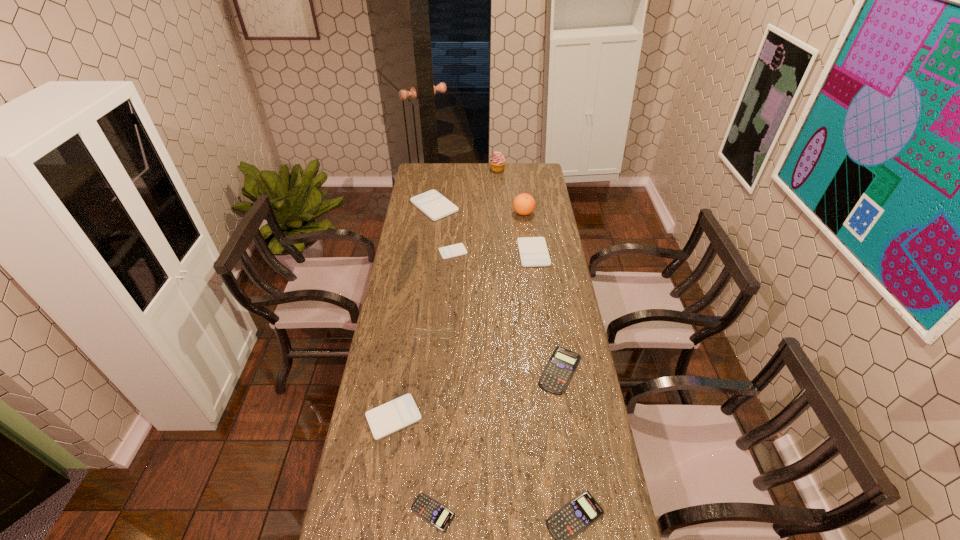
The height and width of the screenshot is (540, 960). Find the location of `vacant space at the far left corner of the desktop`. vacant space at the far left corner of the desktop is located at coordinates (432, 166).

This screenshot has height=540, width=960. Find the location of `unoccupied position between the orange and the leftmost blue calculator`. unoccupied position between the orange and the leftmost blue calculator is located at coordinates tap(478, 363).

At what (x,y) coordinates should I click in order to perform the action: click on free point between the orange and the biggest blue calculator. Please return your answer as a coordinate pair (x, y). Image resolution: width=960 pixels, height=540 pixels. Looking at the image, I should click on (541, 292).

The width and height of the screenshot is (960, 540). In order to click on vacant space in between the smallest white calculator and the fourth tallest object in this screenshot , I will do `click(444, 229)`.

Find the location of a particular element. This screenshot has width=960, height=540. free space between the sixth object from left to right and the farthest blue calculator is located at coordinates (529, 270).

Image resolution: width=960 pixels, height=540 pixels. Find the location of `free point between the farthest blue calculator and the fifth tallest object`. free point between the farthest blue calculator and the fifth tallest object is located at coordinates (547, 312).

This screenshot has width=960, height=540. In order to click on empty space between the orange orange and the smallest blue calculator in this screenshot , I will do `click(478, 363)`.

The height and width of the screenshot is (540, 960). In order to click on vacant area that lies between the third tallest object and the farthest white calculator in this screenshot , I will do `click(435, 265)`.

Choose which object is the sixth nearest neighbor to the shortest calculator. Please provide its 2D coordinates. Your answer should be formatted as a tuple, i.e. [(x, y)], where the tuple contains the x and y coordinates of a point satisfying the conditions above.

[(455, 250)]

At what (x,y) coordinates should I click in order to perform the action: click on the fifth closest object to the sixth object from left to right. Please return your answer as a coordinate pair (x, y). This screenshot has width=960, height=540. Looking at the image, I should click on (446, 333).